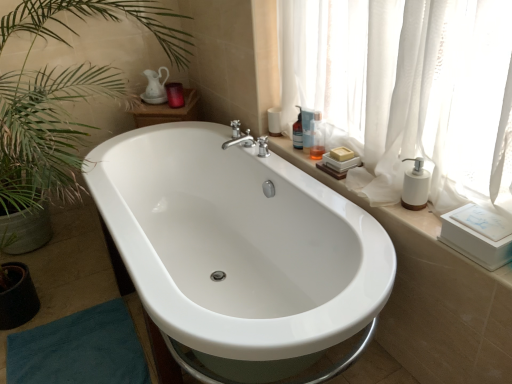
Question: In terms of height, does translucent glass bottle at upper right, marked as the 3th toiletry in a right-to-left arrangement, look taller or shorter compared to translucent plastic bottle at upper right, the fourth toiletry viewed from the left?

Choices:
 (A) short
 (B) tall

Answer: (A)

Question: Is translucent glass bottle at upper right, positioned as the 3th toiletry in front-to-back order, to the left or to the right of translucent plastic bottle at upper right, the fourth toiletry viewed from the left, in the image?

Choices:
 (A) right
 (B) left

Answer: (B)

Question: Estimate the real-world distances between objects in this image. Which object is farther from the translucent glass bottle at upper right, the 2th toiletry in the left-to-right sequence?

Choices:
 (A) white sheer curtain at upper right
 (B) translucent plastic bottle at upper right, the 2th toiletry when ordered from front to back
 (C) white ceramic window sill at upper right
 (D) white glossy bathtub at center
 (E) matte purple candle at upper center, the first toiletry from the back

Answer: (E)

Question: Which of these objects is positioned closest to the white ceramic window sill at upper right?

Choices:
 (A) white glossy bathtub at center
 (B) white matte soap dispenser at right
 (C) translucent plastic bottle at upper right, positioned as the second toiletry in right-to-left order
 (D) translucent plastic bottle at upper right, which is the 4th toiletry in back-to-front order
 (E) teal fabric bath mat at lower left

Answer: (B)